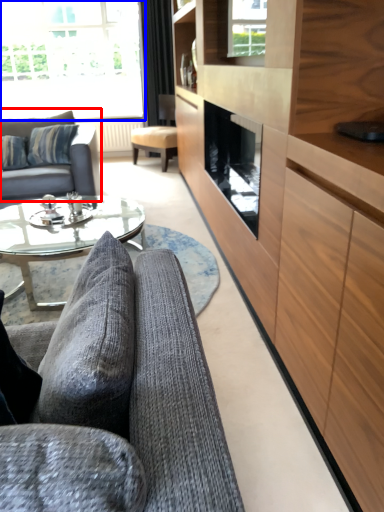
Question: Which of the following is the farthest to the observer, studio couch (highlighted by a red box) or window (highlighted by a blue box)?

Choices:
 (A) studio couch
 (B) window

Answer: (B)